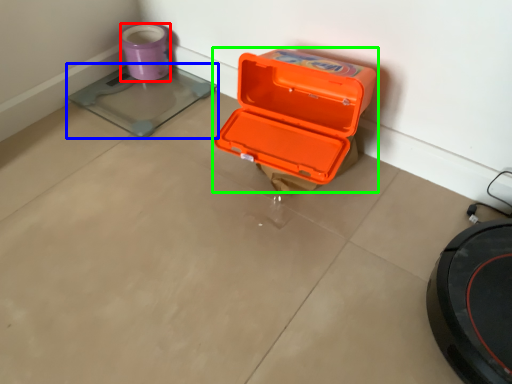
Question: Which object is the farthest from appliance (highlighted by a red box)? Choose among these: weight scale (highlighted by a blue box) or box (highlighted by a green box).

Choices:
 (A) weight scale
 (B) box

Answer: (B)